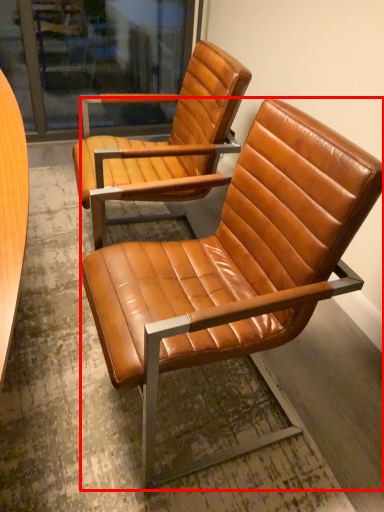
Question: From the image's perspective, what is the correct spatial positioning of chair (annotated by the red box) in reference to chair?

Choices:
 (A) above
 (B) below

Answer: (B)